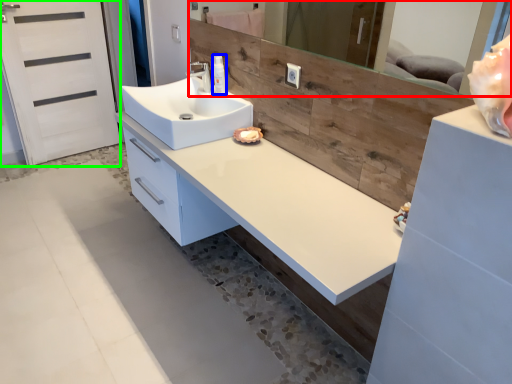
Question: Which is nearer to the mirror (highlighted by a red box)? toiletry (highlighted by a blue box) or screen door (highlighted by a green box).

Choices:
 (A) toiletry
 (B) screen door

Answer: (A)